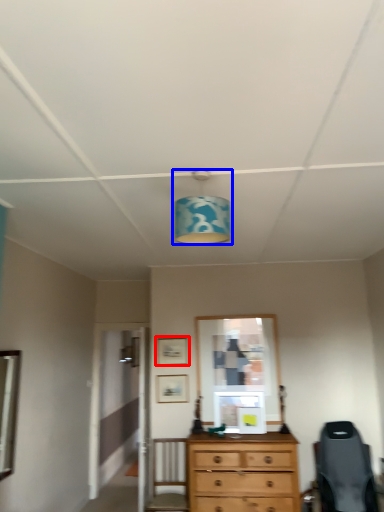
Question: Which point is closer to the camera, picture frame (highlighted by a red box) or light fixture (highlighted by a blue box)?

Choices:
 (A) picture frame
 (B) light fixture

Answer: (B)